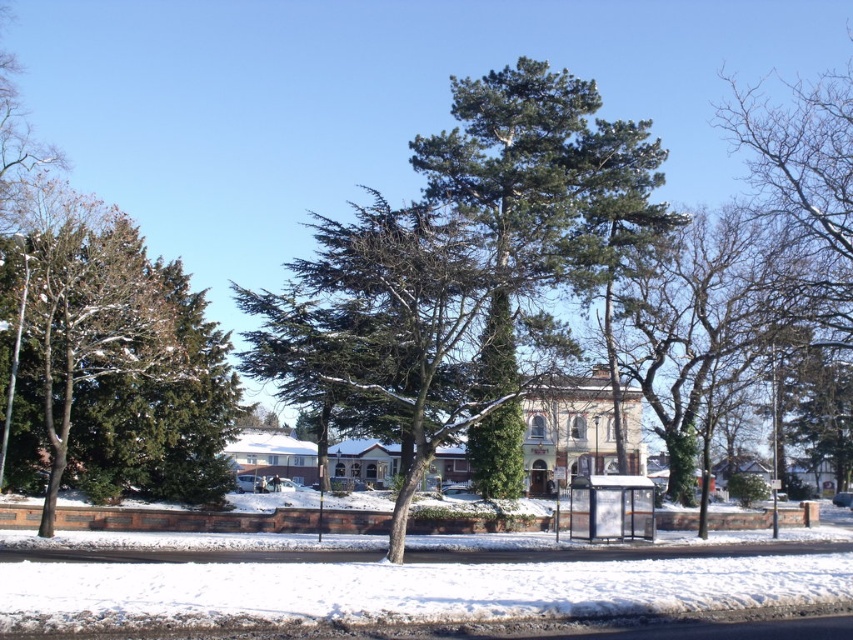
Can you confirm if green textured tree at left is positioned to the right of transparent plastic bus stop at center?

Incorrect, green textured tree at left is not on the right side of transparent plastic bus stop at center.

Is green textured tree at left wider than transparent plastic bus stop at center?

Yes, green textured tree at left is wider than transparent plastic bus stop at center.

Identify the location of green textured tree at left. The image size is (853, 640). (93, 316).

Can you confirm if green leafy tree at center is positioned to the right of green textured tree at left?

Indeed, green leafy tree at center is positioned on the right side of green textured tree at left.

Is green leafy tree at center positioned behind green textured tree at left?

No.

You are a GUI agent. You are given a task and a screenshot of the screen. Output one action in this format:
    pyautogui.click(x=<x>, y=<y>)
    Task: Click on the green leafy tree at center
    The width and height of the screenshot is (853, 640).
    Given the screenshot: What is the action you would take?
    pyautogui.click(x=695, y=333)

Does green needle-like at center appear on the right side of transparent plastic bus stop at center?

Yes, green needle-like at center is to the right of transparent plastic bus stop at center.

Describe the element at coordinates (540, 189) in the screenshot. The width and height of the screenshot is (853, 640). I see `green needle-like at center` at that location.

The image size is (853, 640). What are the coordinates of `green needle-like at center` in the screenshot? It's located at (540, 189).